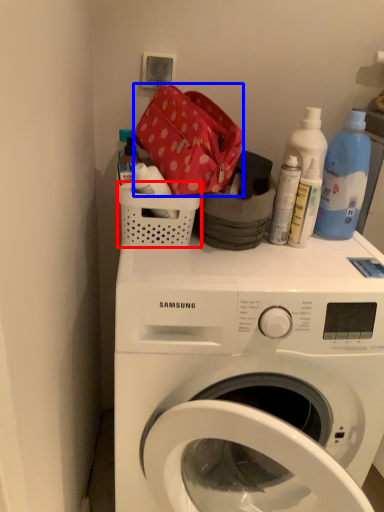
Question: Among these objects, which one is nearest to the camera, basket (highlighted by a red box) or material (highlighted by a blue box)?

Choices:
 (A) basket
 (B) material

Answer: (B)